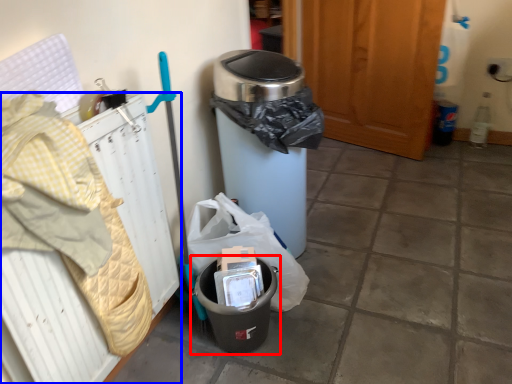
Question: Which of the following is the closest to the observer, waste container (highlighted by a red box) or radiator (highlighted by a blue box)?

Choices:
 (A) waste container
 (B) radiator

Answer: (B)